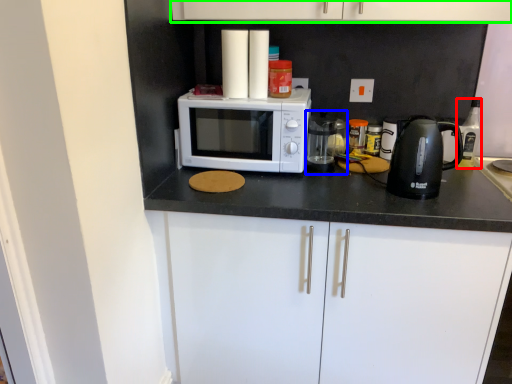
Question: Estimate the real-world distances between objects in this image. Which object is closer to bottle (highlighted by a red box), appliance (highlighted by a blue box) or cabinetry (highlighted by a green box)?

Choices:
 (A) appliance
 (B) cabinetry

Answer: (A)